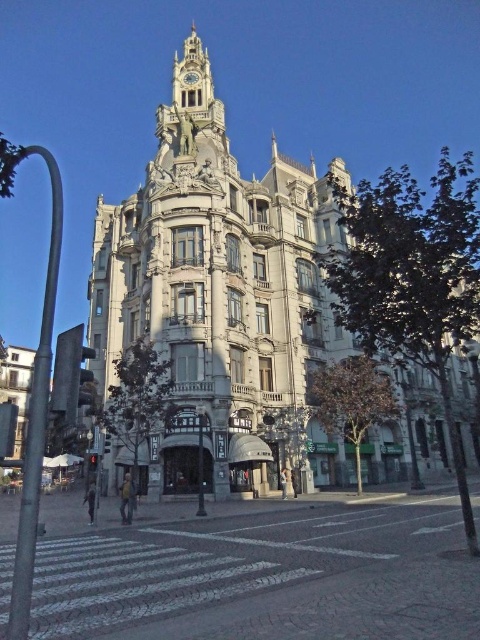
You are a drone operator tasked with capturing aerial footage of the matte gray building at left and the gold metallic clock at upper center. Your drone has a maximum flight range of 65 meters. Can you capture both subjects in a single flight without recharging?

The distance between the matte gray building at left and the gold metallic clock at upper center is 70.64 meters, which exceeds the drone operator drone maximum flight range of 65 meters. Therefore, the drone cannot capture both subjects in a single flight without recharging.

You are standing in front of a grand European building and notice two gray buildings in the scene. According to their positions, which one is the gray stone building at center located higher than the matte gray building at left?

The gray stone building at center is positioned above the matte gray building at left, so it is higher than the matte gray building at left.